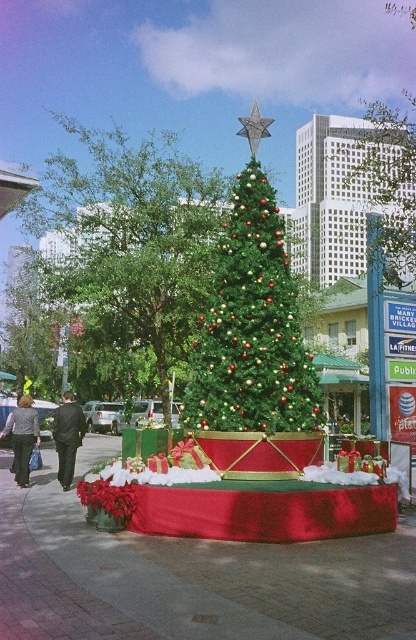
Does brick pavement at center appear on the right side of green shiny christmas tree at center?

Indeed, brick pavement at center is positioned on the right side of green shiny christmas tree at center.

Does point (309, 625) come closer to viewer compared to point (59, 173)?

Yes, it is.

What do you see at coordinates (190, 579) in the screenshot?
I see `brick pavement at center` at bounding box center [190, 579].

Locate an element on the screen. This screenshot has width=416, height=640. brick pavement at center is located at coordinates (190, 579).

Does green shiny christmas tree at center lie behind green textured christmas tree at center?

Yes, it is.

Between green shiny christmas tree at center and green textured christmas tree at center, which one appears on the right side from the viewer's perspective?

From the viewer's perspective, green textured christmas tree at center appears more on the right side.

Which is behind, point (106, 324) or point (277, 296)?

Point (106, 324)

Find the location of a particular element. The image size is (416, 640). green shiny christmas tree at center is located at coordinates (128, 244).

Can you confirm if dark suit at center is shorter than black textured pants at lower left?

No, dark suit at center is not shorter than black textured pants at lower left.

Who is more forward, (x=66, y=461) or (x=31, y=452)?

Point (x=66, y=461)

Locate an element on the screen. The image size is (416, 640). dark suit at center is located at coordinates (67, 436).